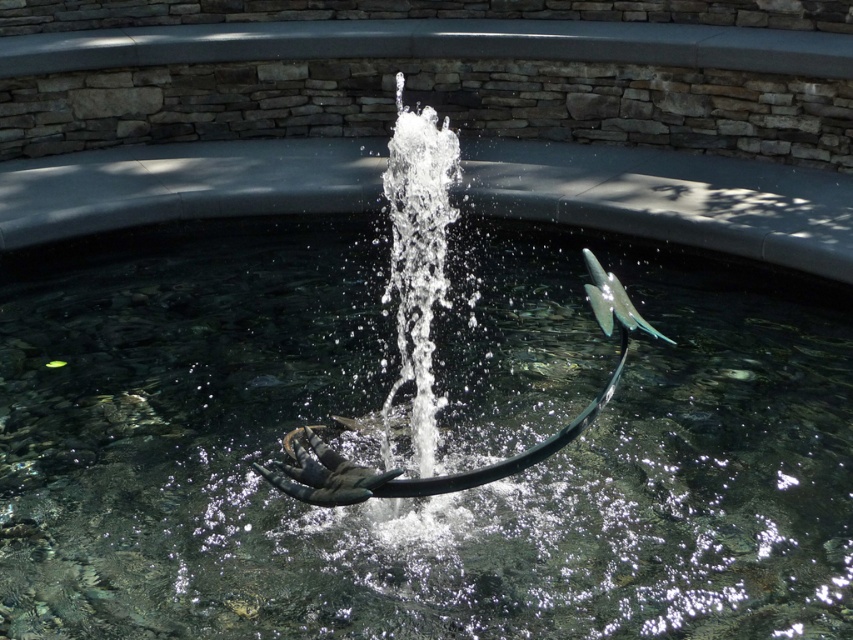
The image size is (853, 640). What are the coordinates of `clear water at center` in the screenshot? It's located at (438, 448).